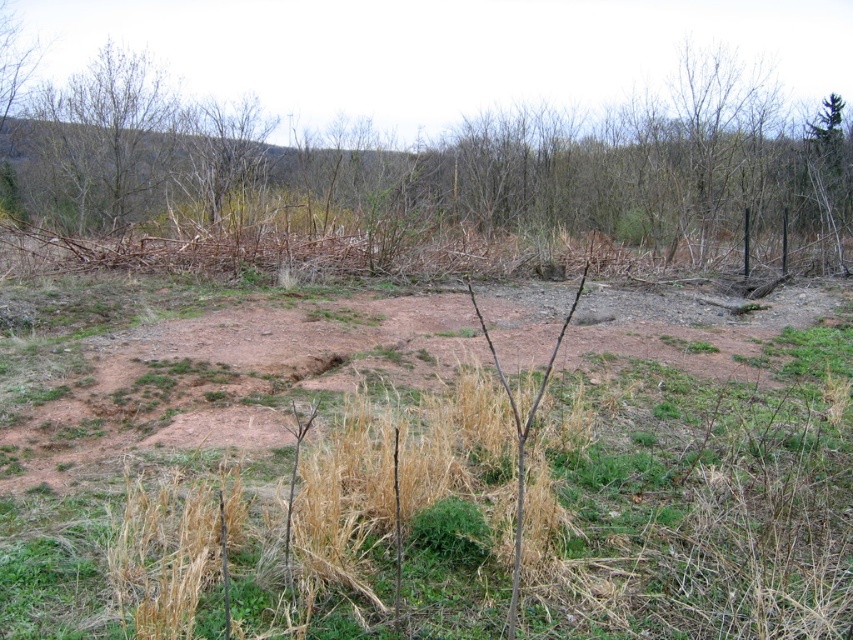
Question: Which object appears closest to the camera in this image?

Choices:
 (A) brown dry grass at upper center
 (B) bare branches at upper left

Answer: (A)

Question: Is brown dry grass at upper center closer to camera compared to bare branches at upper left?

Choices:
 (A) no
 (B) yes

Answer: (B)

Question: Which of the following is the farthest from the observer?

Choices:
 (A) bare branches at upper left
 (B) brown dry grass at upper center

Answer: (A)

Question: Which of the following is the farthest from the observer?

Choices:
 (A) (154, 118)
 (B) (102, 170)

Answer: (A)

Question: Does brown dry grass at upper center have a lesser width compared to bare branches at upper left?

Choices:
 (A) yes
 (B) no

Answer: (B)

Question: Considering the relative positions of brown dry grass at upper center and bare branches at upper left in the image provided, where is brown dry grass at upper center located with respect to bare branches at upper left?

Choices:
 (A) above
 (B) below

Answer: (B)